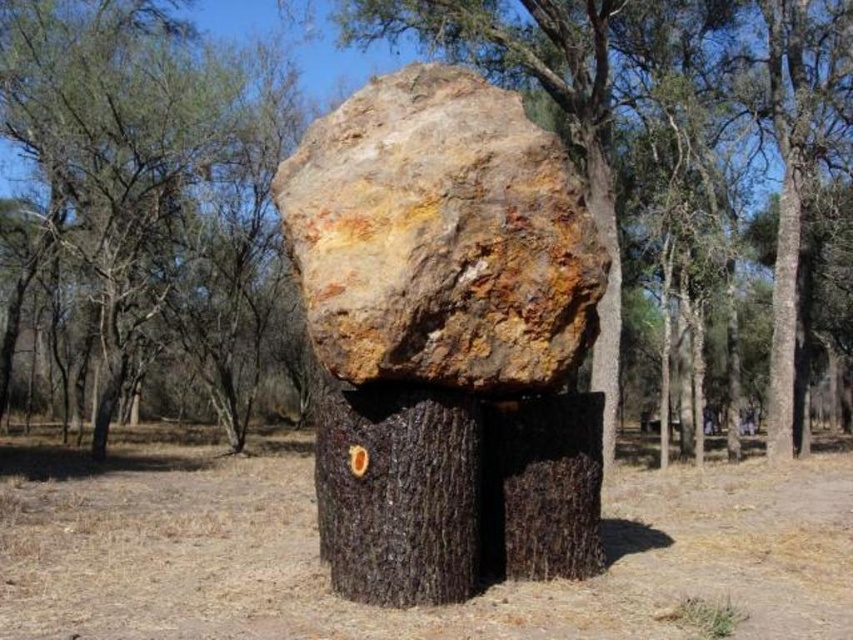
You are a hiker who wants to place a small backpack between the brown rough tree trunk at center and the brown rough bark at center. Based on their positions, which object should you place the backpack closer to in order to ensure stability?

The brown rough tree trunk at center is positioned over brown rough bark at center, so placing the backpack closer to the brown rough tree trunk at center would provide better stability since it is the base supporting the trunk.

You are a hiker who has stumbled upon this forest scene. You notice two objects of interest labeled as brown rough bark at center and brown rough tree trunk at right. Which of these two objects is positioned to the left when viewed from your perspective?

The brown rough bark at center is positioned to the left of the brown rough tree trunk at right.